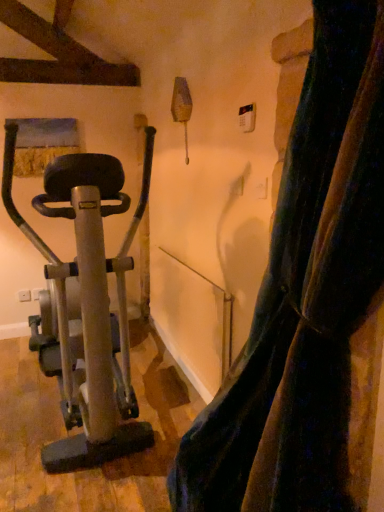
Question: In the image, is silver metallic stationary bicycle at left on the left side or the right side of velvet dark blue curtain at right?

Choices:
 (A) left
 (B) right

Answer: (A)

Question: From a real-world perspective, is silver metallic stationary bicycle at left physically located above or below velvet dark blue curtain at right?

Choices:
 (A) below
 (B) above

Answer: (A)

Question: Looking at their shapes, would you say silver metallic stationary bicycle at left is wider or thinner than velvet dark blue curtain at right?

Choices:
 (A) wide
 (B) thin

Answer: (A)

Question: Considering the positions of velvet dark blue curtain at right and silver metallic stationary bicycle at left in the image, is velvet dark blue curtain at right taller or shorter than silver metallic stationary bicycle at left?

Choices:
 (A) short
 (B) tall

Answer: (B)

Question: Do you think velvet dark blue curtain at right is within silver metallic stationary bicycle at left, or outside of it?

Choices:
 (A) outside
 (B) inside

Answer: (A)

Question: From a real-world perspective, relative to silver metallic stationary bicycle at left, is velvet dark blue curtain at right vertically above or below?

Choices:
 (A) below
 (B) above

Answer: (B)

Question: Is point (372, 436) positioned closer to the camera than point (132, 231)?

Choices:
 (A) farther
 (B) closer

Answer: (B)